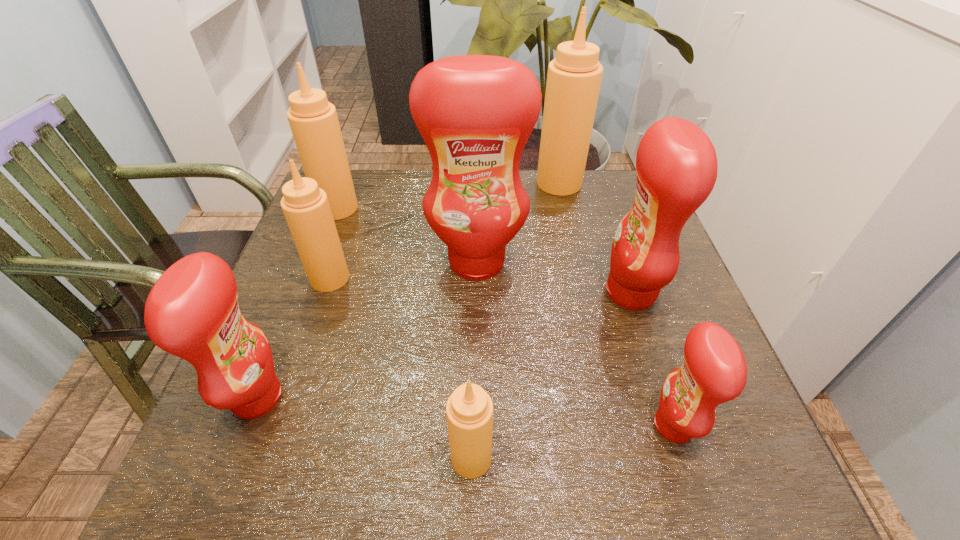
At what (x,y) coordinates should I click in order to perform the action: click on free region located 0.060m on the label side of the smallest red condiment. Please return your answer as a coordinate pair (x, y). Looking at the image, I should click on (616, 426).

In order to click on vacant point located 0.380m on the label side of the smallest red condiment in this screenshot , I will do `click(428, 426)`.

Where is `vacant space located 0.150m on the label side of the smallest red condiment`? vacant space located 0.150m on the label side of the smallest red condiment is located at coordinates (564, 426).

The width and height of the screenshot is (960, 540). I want to click on object that is positioned at the far left corner, so click(313, 120).

Image resolution: width=960 pixels, height=540 pixels. I want to click on object present at the near left corner, so click(x=192, y=312).

Identify the location of object present at the far right corner. This screenshot has height=540, width=960. (574, 77).

Where is `object located in the near right corner section of the desktop`? The image size is (960, 540). object located in the near right corner section of the desktop is located at coordinates (714, 371).

This screenshot has height=540, width=960. What are the coordinates of `free location at the far edge` in the screenshot? It's located at (576, 206).

The image size is (960, 540). Find the location of `blank space at the near edge of the desktop`. blank space at the near edge of the desktop is located at coordinates (442, 494).

Locate an element on the screen. The height and width of the screenshot is (540, 960). free region at the left edge of the desktop is located at coordinates (276, 333).